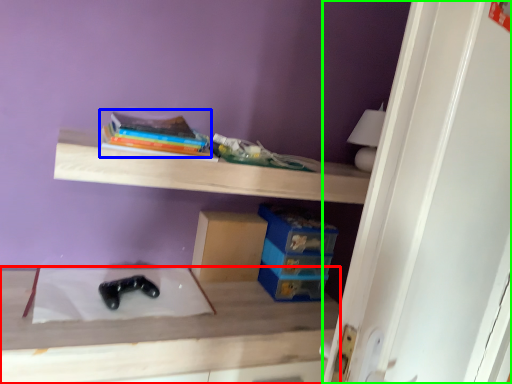
Question: Considering the real-world distances, which object is closest to table (highlighted by a red box)? book (highlighted by a blue box) or door (highlighted by a green box).

Choices:
 (A) book
 (B) door

Answer: (A)